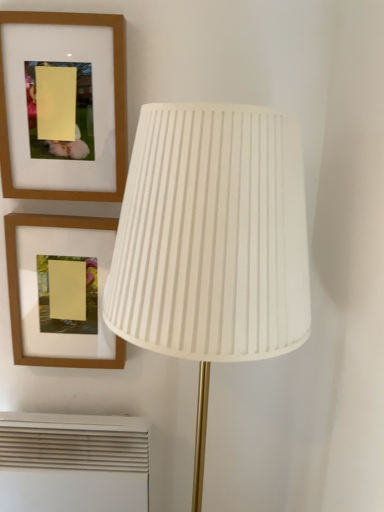
Question: Is white pleated fabric lampshade at center placed right next to white plastic air conditioner at lower left?

Choices:
 (A) no
 (B) yes

Answer: (A)

Question: Is white pleated fabric lampshade at center further to the viewer compared to white plastic air conditioner at lower left?

Choices:
 (A) no
 (B) yes

Answer: (A)

Question: Considering the relative positions of white pleated fabric lampshade at center and white plastic air conditioner at lower left in the image provided, is white pleated fabric lampshade at center to the left of white plastic air conditioner at lower left from the viewer's perspective?

Choices:
 (A) yes
 (B) no

Answer: (B)

Question: From the image's perspective, is white pleated fabric lampshade at center above white plastic air conditioner at lower left?

Choices:
 (A) no
 (B) yes

Answer: (B)

Question: Is white pleated fabric lampshade at center far away from white plastic air conditioner at lower left?

Choices:
 (A) no
 (B) yes

Answer: (A)

Question: Is white pleated fabric lampshade at center taller than white plastic air conditioner at lower left?

Choices:
 (A) yes
 (B) no

Answer: (A)

Question: From the image's perspective, is white plastic air conditioner at lower left above white pleated fabric lampshade at center?

Choices:
 (A) no
 (B) yes

Answer: (A)

Question: Is white plastic air conditioner at lower left thinner than white pleated fabric lampshade at center?

Choices:
 (A) yes
 (B) no

Answer: (A)

Question: Is white plastic air conditioner at lower left bigger than white pleated fabric lampshade at center?

Choices:
 (A) no
 (B) yes

Answer: (A)

Question: Is white plastic air conditioner at lower left at the left side of white pleated fabric lampshade at center?

Choices:
 (A) no
 (B) yes

Answer: (B)

Question: Can you confirm if white plastic air conditioner at lower left is wider than white pleated fabric lampshade at center?

Choices:
 (A) no
 (B) yes

Answer: (A)

Question: Is white plastic air conditioner at lower left to the right of white pleated fabric lampshade at center from the viewer's perspective?

Choices:
 (A) no
 (B) yes

Answer: (A)

Question: Is wooden frame at upper left, which ranks as the second picture frame in bottom-to-top order, at the right side of wooden picture frame at upper left, arranged as the second picture frame when viewed from the top?

Choices:
 (A) no
 (B) yes

Answer: (B)